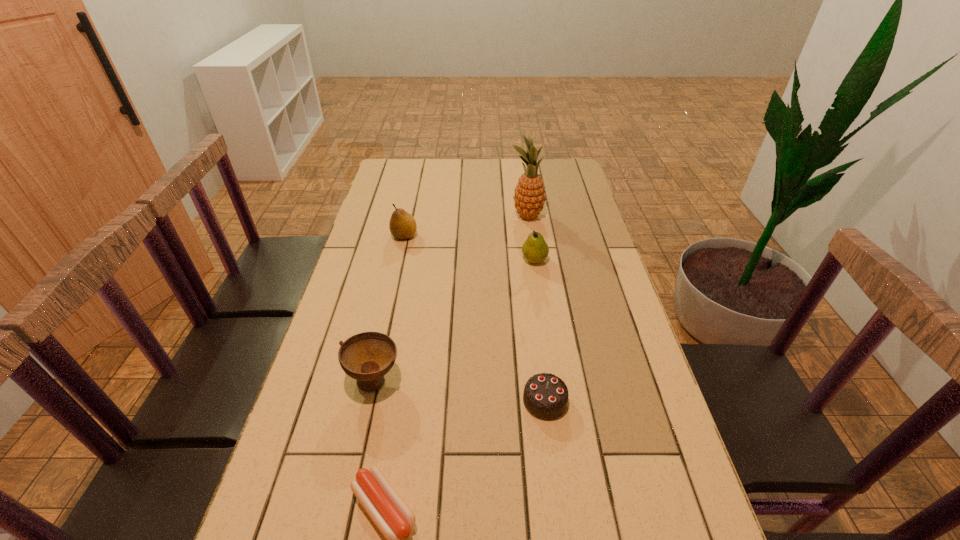
Where is `the farthest object`? This screenshot has width=960, height=540. the farthest object is located at coordinates (529, 198).

At what (x,y) coordinates should I click in order to perform the action: click on pineapple. Please return your answer as a coordinate pair (x, y). The height and width of the screenshot is (540, 960). Looking at the image, I should click on (529, 198).

Where is `the left pear`? The height and width of the screenshot is (540, 960). the left pear is located at coordinates (402, 225).

At what (x,y) coordinates should I click in order to perform the action: click on the second farthest object. Please return your answer as a coordinate pair (x, y). Image resolution: width=960 pixels, height=540 pixels. Looking at the image, I should click on (402, 225).

The image size is (960, 540). What are the coordinates of `the nearer pear` in the screenshot? It's located at (535, 249).

You are a GUI agent. You are given a task and a screenshot of the screen. Output one action in this format:
    pyautogui.click(x=<x>, y=<y>)
    Task: Click on the right pear
    The width and height of the screenshot is (960, 540).
    Given the screenshot: What is the action you would take?
    pyautogui.click(x=535, y=249)

Find the location of a particular element. The height and width of the screenshot is (540, 960). soup bowl is located at coordinates (367, 357).

Identify the location of chocolate cake. (545, 396).

Locate an element on the screen. vacant region located on the left of the pineapple is located at coordinates (459, 216).

Identify the location of blank area located on the front of the left pear. (397, 268).